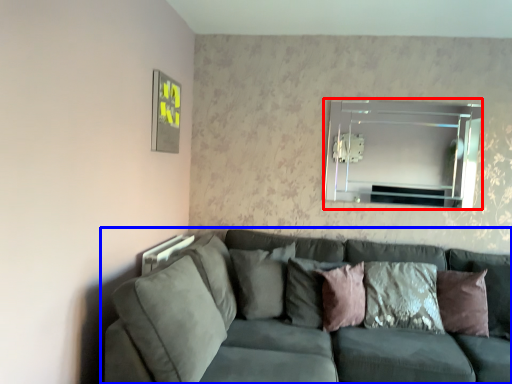
Question: Among these objects, which one is farthest to the camera, mirror (highlighted by a red box) or studio couch (highlighted by a blue box)?

Choices:
 (A) mirror
 (B) studio couch

Answer: (A)